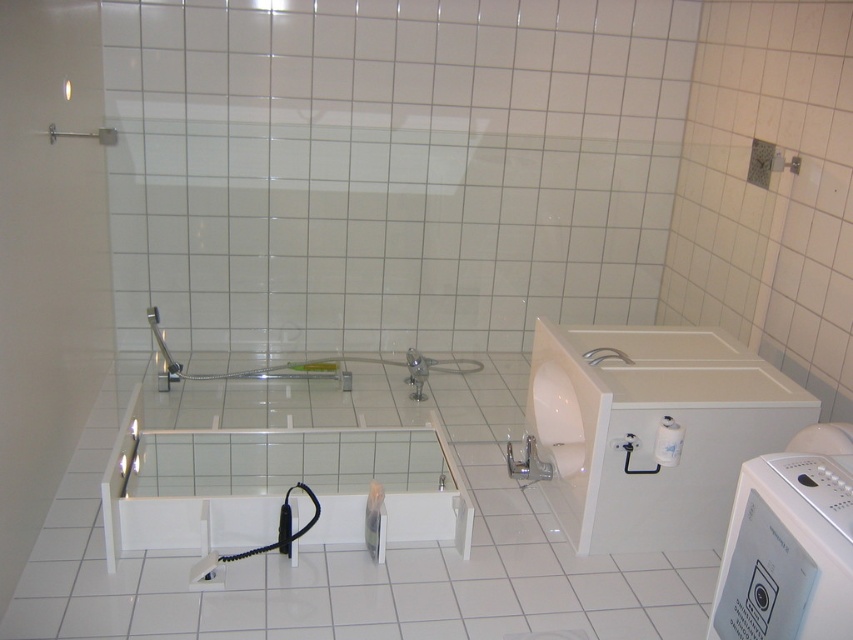
Question: Does white glossy washing machine at right have a smaller size compared to white glossy bathtub at center?

Choices:
 (A) no
 (B) yes

Answer: (B)

Question: Is white glossy washing machine at right to the left of white plastic washing machine at lower right from the viewer's perspective?

Choices:
 (A) no
 (B) yes

Answer: (B)

Question: Which of the following is the farthest from the observer?

Choices:
 (A) white glossy washing machine at right
 (B) white plastic washing machine at lower right
 (C) white glossy bathtub at center

Answer: (A)

Question: Which object is farther from the camera taking this photo?

Choices:
 (A) white plastic washing machine at lower right
 (B) white glossy washing machine at right

Answer: (B)

Question: Does white glossy bathtub at center appear over white plastic washing machine at lower right?

Choices:
 (A) yes
 (B) no

Answer: (A)

Question: Among these points, which one is nearest to the camera?

Choices:
 (A) (219, 545)
 (B) (791, 524)

Answer: (B)